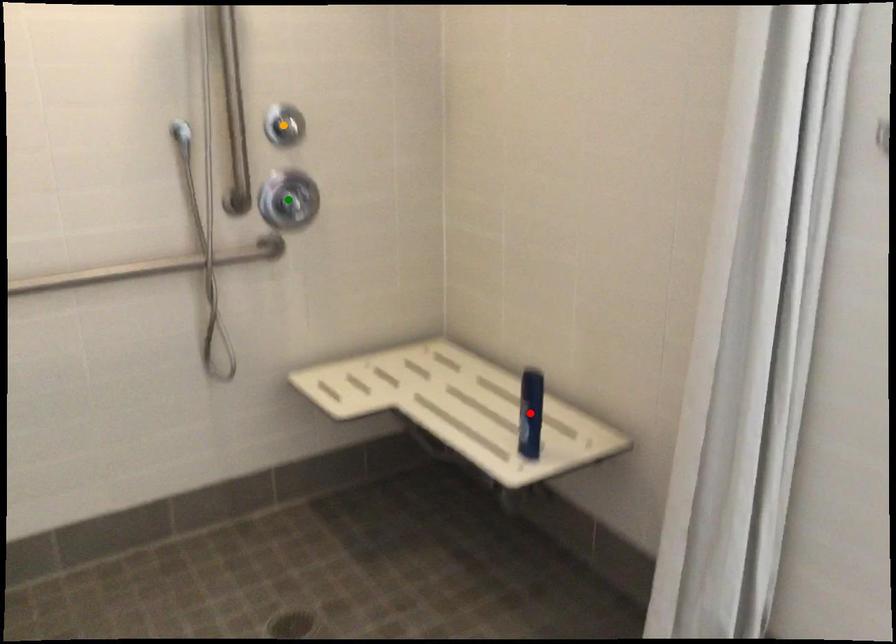
Order these from nearest to farthest:
orange point | red point | green point

red point < orange point < green point